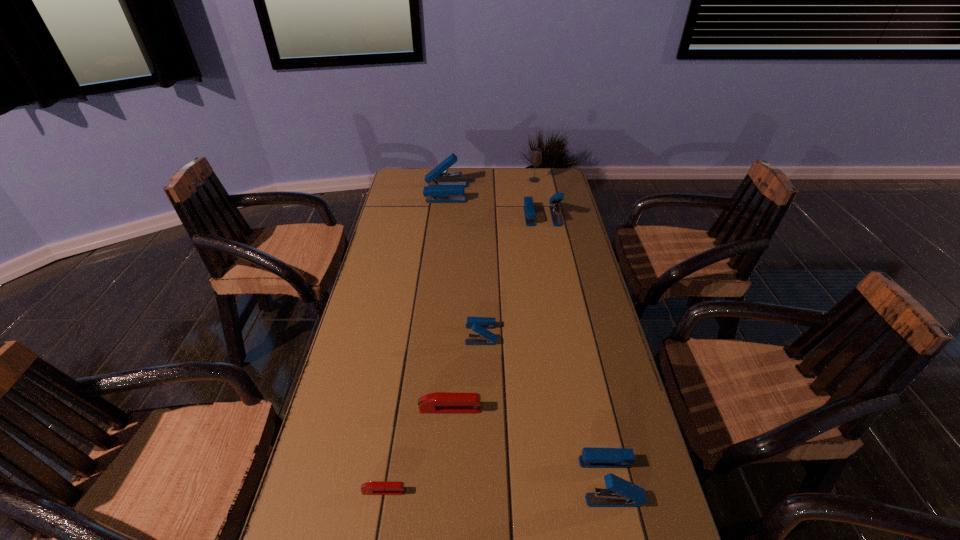
This screenshot has width=960, height=540. Identify the location of blank region between the nearer red stapler and the fifth shortest stapler. (463, 354).

This screenshot has width=960, height=540. In order to click on free area in between the farthest object and the bigger red stapler in this screenshot , I will do `click(492, 295)`.

Where is `free space between the bigger red stapler and the nearer red stapler`? free space between the bigger red stapler and the nearer red stapler is located at coordinates (417, 450).

Locate which object ranks sixth in proximity to the third nearest stapler. Please provide its 2D coordinates. Your answer should be formatted as a tuple, i.e. [(x, y)], where the tuple contains the x and y coordinates of a point satisfying the conditions above.

[(536, 154)]

Image resolution: width=960 pixels, height=540 pixels. Identify the location of the third closest object relative to the second farthest object. (479, 325).

Locate an element on the screen. stapler object that ranks as the second closest to the second smallest blue stapler is located at coordinates (479, 325).

Where is `stapler identified as the fifth closest to the glass drink container`? stapler identified as the fifth closest to the glass drink container is located at coordinates (619, 493).

Find the location of a particular element. Image resolution: width=960 pixels, height=540 pixels. the second closest blue stapler to the fourth nearest stapler is located at coordinates (529, 210).

I want to click on blue stapler that is the second closest to the fourth tallest stapler, so click(529, 210).

Where is `vacant area in the image that satisfies the following two spatial constraints: 1. on the front side of the third biggest blue stapler; 2. on the front-facing side of the shortest stapler`? vacant area in the image that satisfies the following two spatial constraints: 1. on the front side of the third biggest blue stapler; 2. on the front-facing side of the shortest stapler is located at coordinates (612, 491).